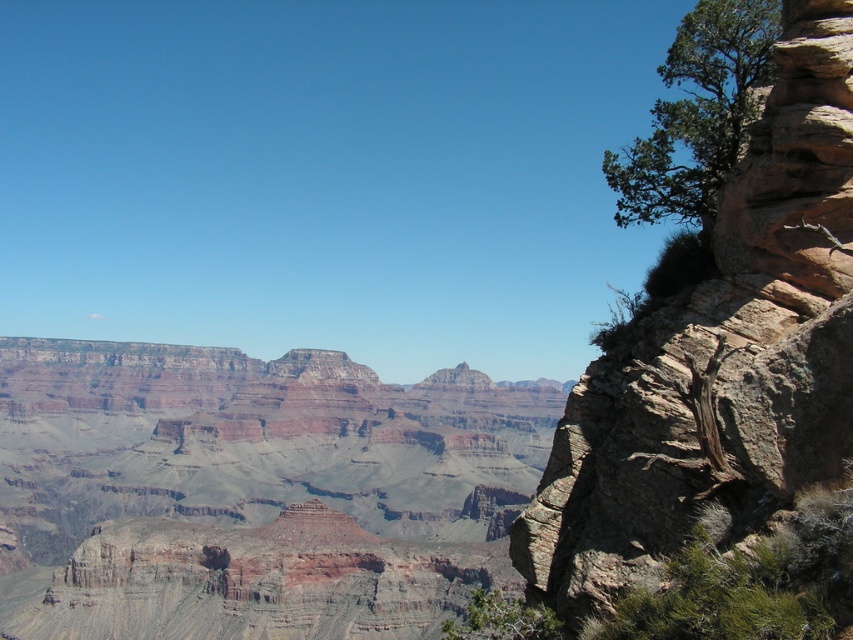
Which is more to the right, rustic brown cliff at right or green leafy tree at lower right?

rustic brown cliff at right is more to the right.

Between rustic brown cliff at right and green leafy tree at lower right, which one is positioned lower?

green leafy tree at lower right is lower down.

Which is behind, point (730, 449) or point (520, 620)?

Positioned behind is point (520, 620).

This screenshot has width=853, height=640. Find the location of `rustic brown cliff at right`. rustic brown cliff at right is located at coordinates (718, 355).

Does green leafy tree at upper right appear over green leafy tree at lower right?

Correct, green leafy tree at upper right is located above green leafy tree at lower right.

Which of these two, green leafy tree at upper right or green leafy tree at lower right, stands taller?

Standing taller between the two is green leafy tree at upper right.

Locate an element on the screen. This screenshot has height=640, width=853. green leafy tree at upper right is located at coordinates (697, 113).

Which is below, rustic red rock canyon at center or green leafy tree at upper right?

rustic red rock canyon at center is lower down.

Does rustic red rock canyon at center have a smaller size compared to green leafy tree at upper right?

Yes, rustic red rock canyon at center is smaller than green leafy tree at upper right.

Between point (57, 387) and point (769, 0), which one is positioned in front?

Point (769, 0)

Locate an element on the screen. The image size is (853, 640). rustic red rock canyon at center is located at coordinates (253, 492).